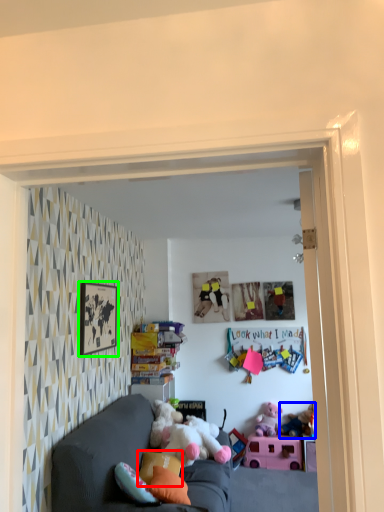
Question: Which object is positioned farthest from pillow (highlighted by a red box)? Select from toy (highlighted by a blue box) and picture frame (highlighted by a green box).

Choices:
 (A) toy
 (B) picture frame

Answer: (A)